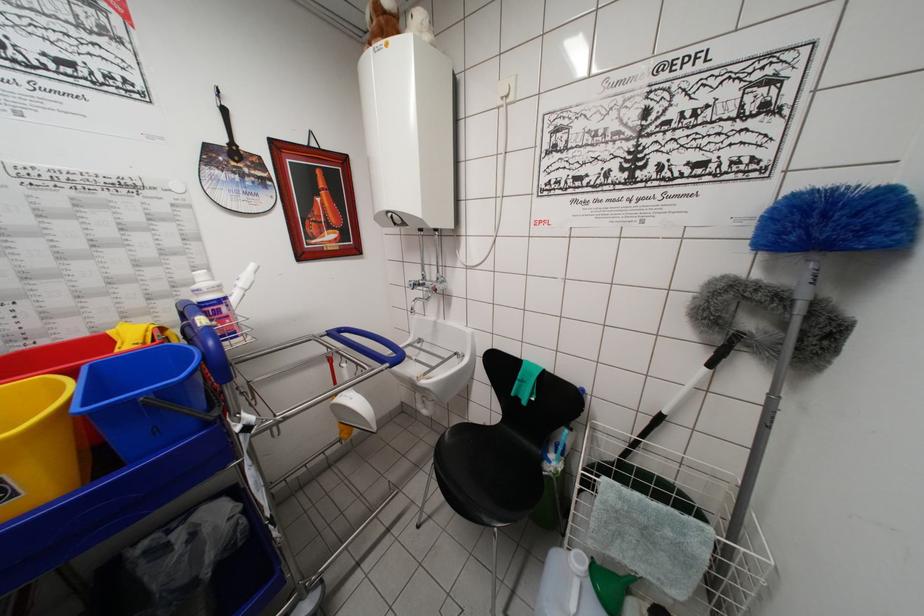
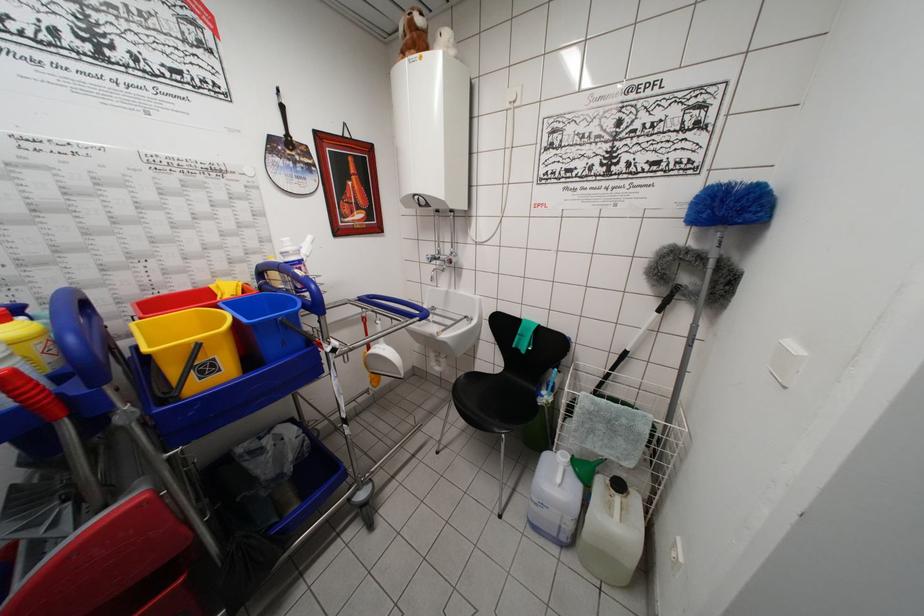
The point at (647, 440) is marked in the first image. Where is the corresponding point in the second image?

(616, 374)